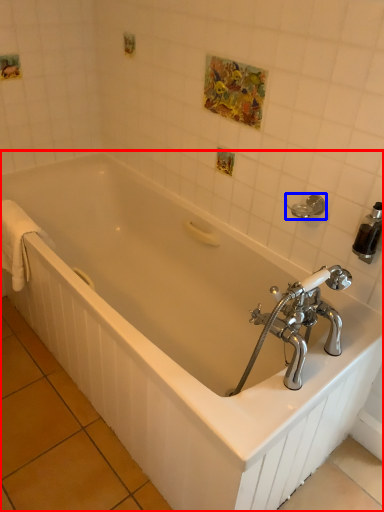
Question: Which object is closer to the camera taking this photo, bathtub (highlighted by a red box) or towel bar (highlighted by a blue box)?

Choices:
 (A) bathtub
 (B) towel bar

Answer: (A)